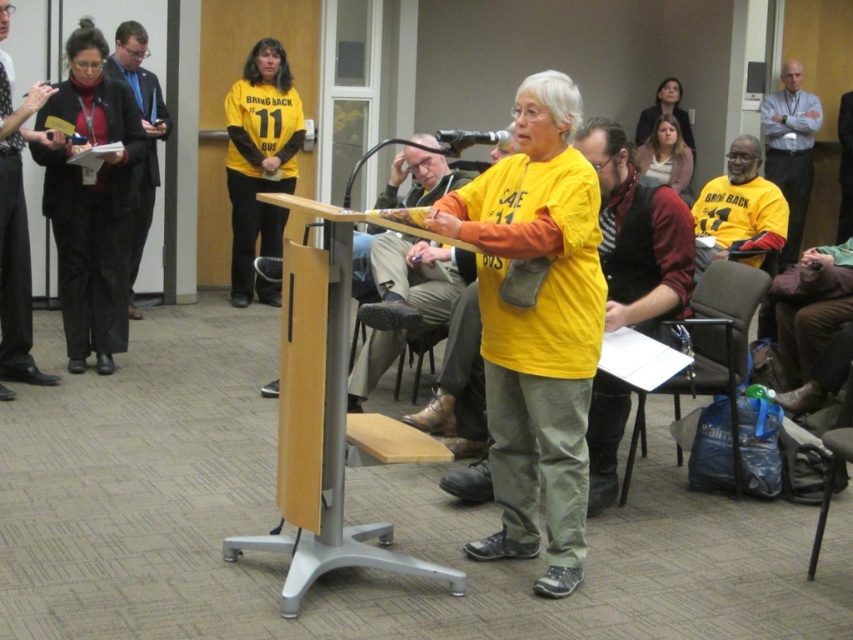
You are a photographer positioned to the right of the podium. You want to capture a photo that includes both the black fabric jacket at left and the khaki pants at center. Which object should you adjust your camera angle to include first?

The black fabric jacket at left is to the left of the khaki pants at center, so you should adjust your camera angle to include the black fabric jacket at left first since it is farther to the left compared to the khaki pants at center.

You are a photographer trying to capture a candid shot of the speaker without them noticing. You are standing behind the black fabric jacket at left and khaki pants at center. If you need to move closer to the podium, which direction should you move to avoid being noticed by the speaker?

Since the black fabric jacket at left and khaki pants at center are 1.74 meters apart, moving towards the podium from between them would keep you hidden behind the two objects, so you should move forward between the black fabric jacket at left and khaki pants at center.